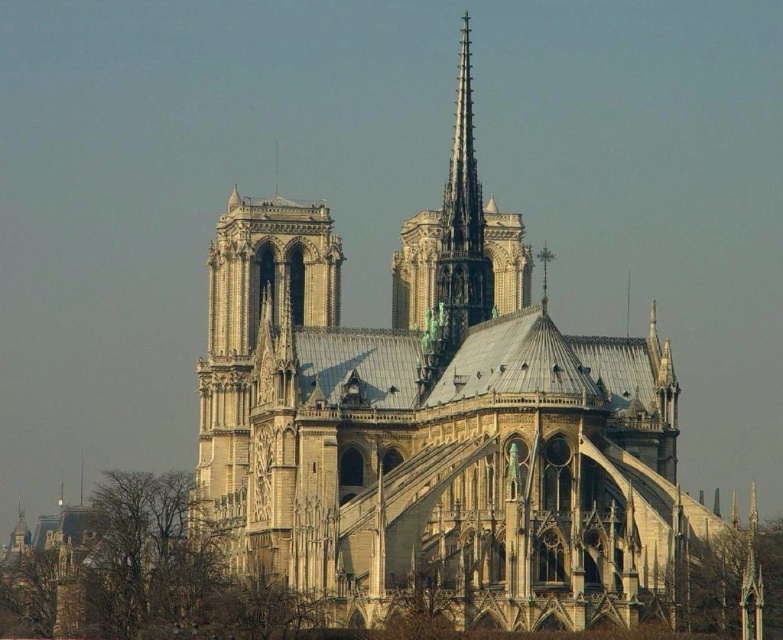
Between stone church at center and dark gray stone spire at center, which one appears on the right side from the viewer's perspective?

From the viewer's perspective, stone church at center appears more on the right side.

Identify the location of stone church at center. (435, 426).